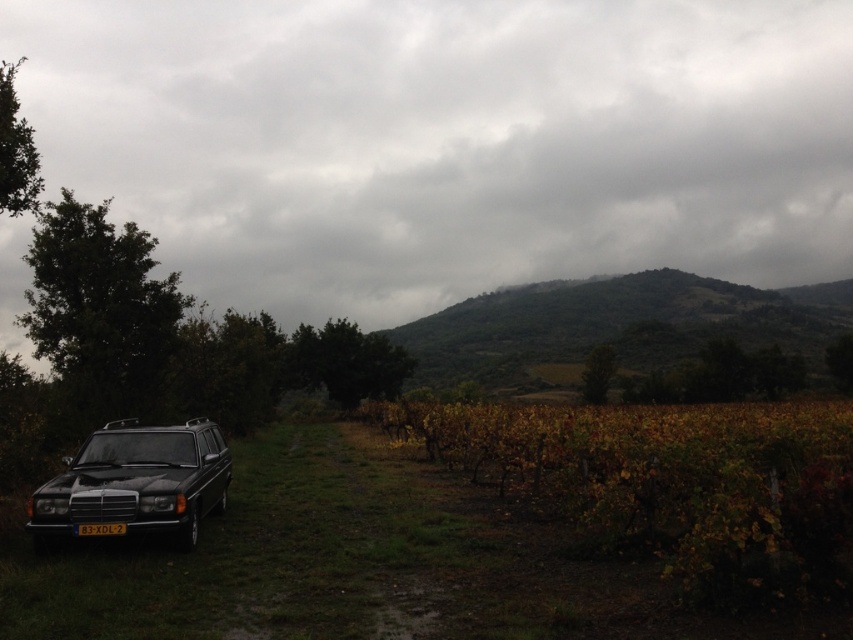
Question: In this image, where is matte black station wagon at lower left located relative to black plastic license plate at lower left?

Choices:
 (A) above
 (B) below

Answer: (A)

Question: Which of the following is the closest to the observer?

Choices:
 (A) matte black station wagon at lower left
 (B) black plastic license plate at lower left

Answer: (A)

Question: Is matte black station wagon at lower left to the right of black plastic license plate at lower left from the viewer's perspective?

Choices:
 (A) no
 (B) yes

Answer: (A)

Question: Which object is closer to the camera taking this photo?

Choices:
 (A) matte black station wagon at lower left
 (B) black plastic license plate at lower left

Answer: (A)

Question: Can you confirm if matte black station wagon at lower left is smaller than black plastic license plate at lower left?

Choices:
 (A) yes
 (B) no

Answer: (B)

Question: Which object appears closest to the camera in this image?

Choices:
 (A) matte black station wagon at lower left
 (B) black plastic license plate at lower left

Answer: (A)